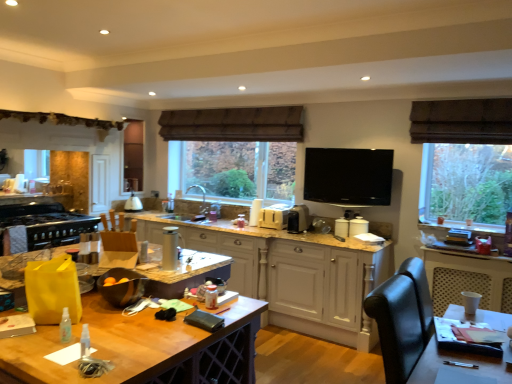
Identify the location of vacant space to the right of silver metallic thermos at center, the third appliance from the left. The image size is (512, 384). (194, 268).